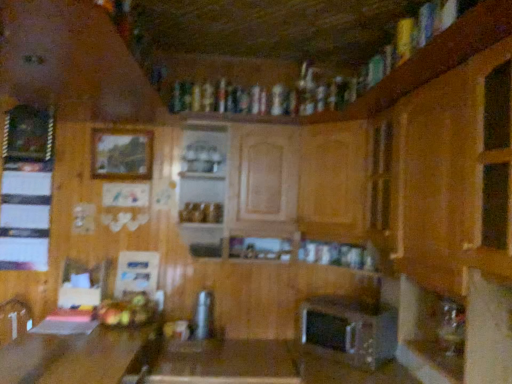
Image resolution: width=512 pixels, height=384 pixels. What are the coordinates of `vacant space to the right of metallic silver toaster at center, which is the second appliance in right-to-left order` in the screenshot? It's located at (223, 340).